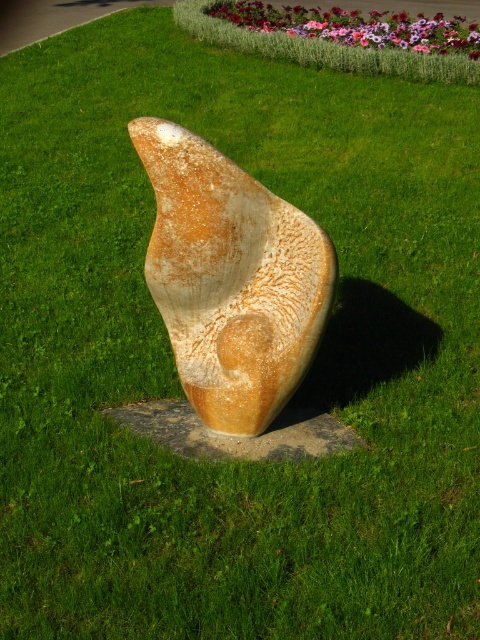
You are a landscape architect designing a garden pathway. You need to place a 20 inch wide bench between the rustic stone sculpture at center and the rusty stone sculpture at center. Is there enough space between them to fit the bench?

The rustic stone sculpture at center and the rusty stone sculpture at center are 18.93 inches apart. Since the bench is 20 inches wide, there isn not enough space between them to fit the bench.

You are standing in front of the sculpture and want to touch both the rustic stone sculpture at center and the rusty stone sculpture at center. Which one can you reach first without moving your feet?

The rustic stone sculpture at center is closer to the viewer than the rusty stone sculpture at center, so you can reach it first without moving your feet.